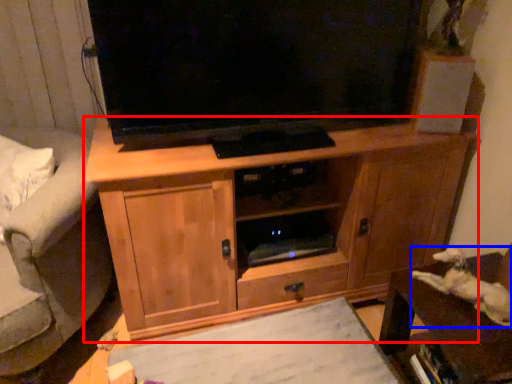
Question: Which of the following is the farthest to the observer, cabinetry (highlighted by a red box) or animal (highlighted by a blue box)?

Choices:
 (A) cabinetry
 (B) animal

Answer: (A)